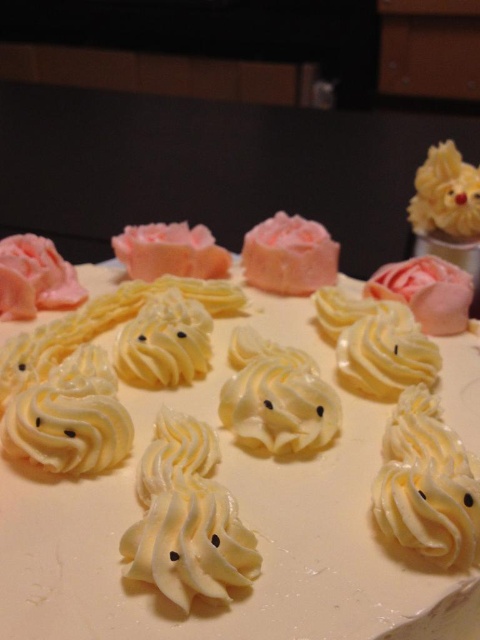
You are a food stylist who needs to adjust the position of the white cream meringues at center so that they are exactly 30 inches away from the camera. Currently, they are 26.65 inches away. How much further should you move them?

The white cream meringues at center are currently 26.65 inches away from the camera. To reach the desired distance of 30 inches, you need to move them 3.35 inches further away.

You are a decorator trying to add a new decoration to the cake. You want to place a new decoration between point (414,573) and point (261,272). Which point should you place it closer to so that it appears in the middle of the two points from the viewer perspective?

To place the new decoration in the middle between point (414,573) and point (261,272) from the viewer perspective, you should place it closer to point (414,573) since it is closer to the viewer than point (261,272).